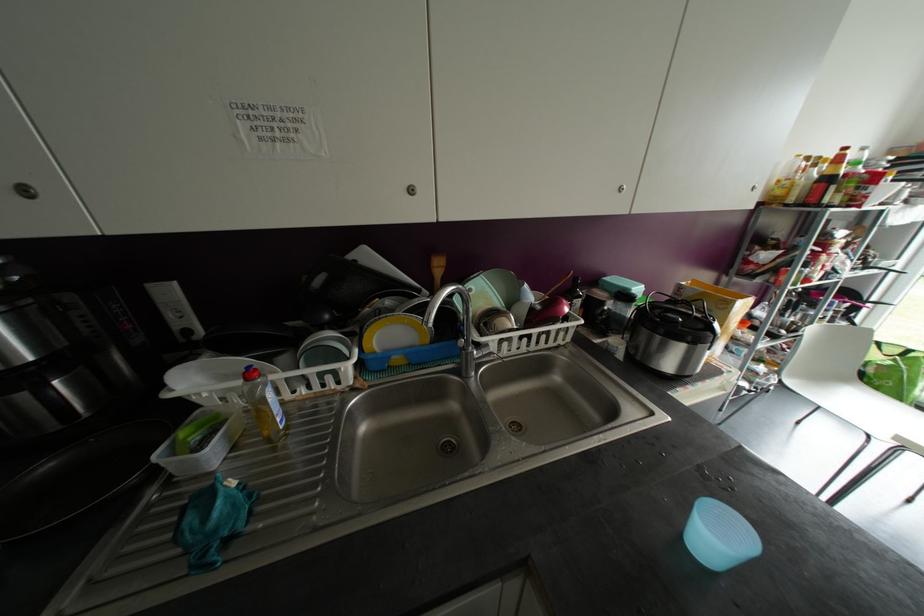
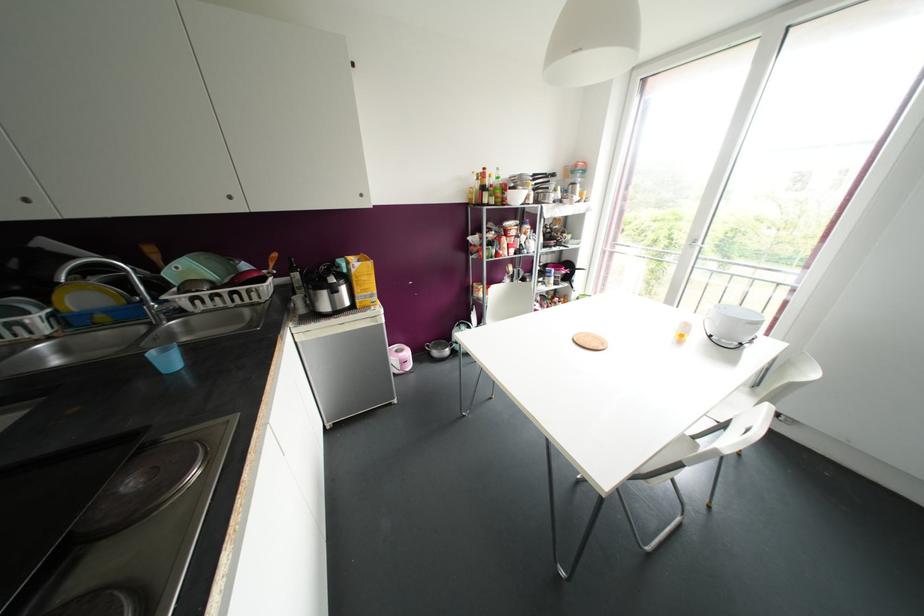
The point at (565, 310) is marked in the first image. Where is the corresponding point in the second image?

(251, 277)